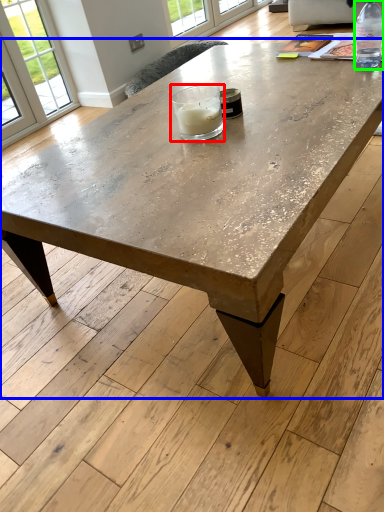
Question: Based on their relative distances, which object is farther from candle holder (highlighted by a red box)? Choose from coffee table (highlighted by a blue box) and bottle (highlighted by a green box).

Choices:
 (A) coffee table
 (B) bottle

Answer: (B)